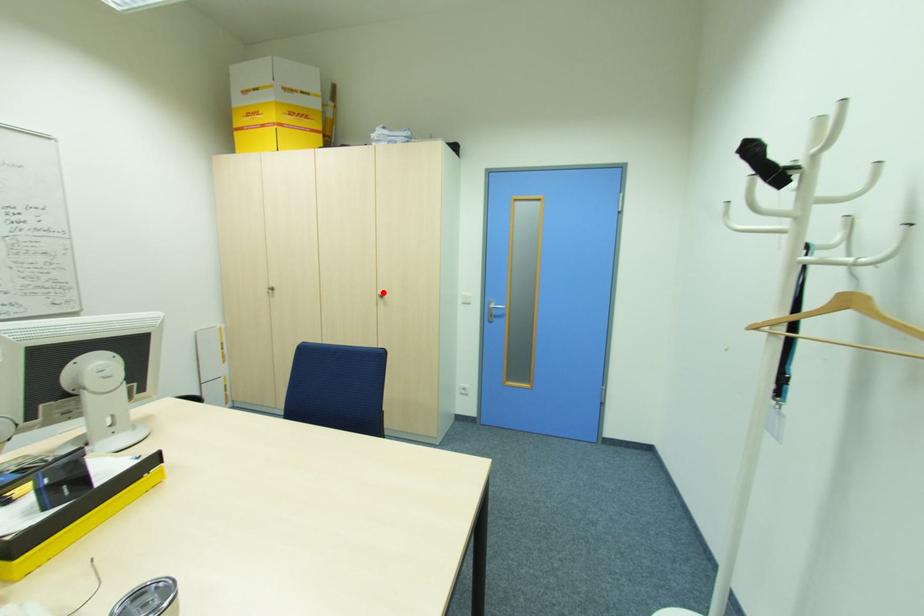
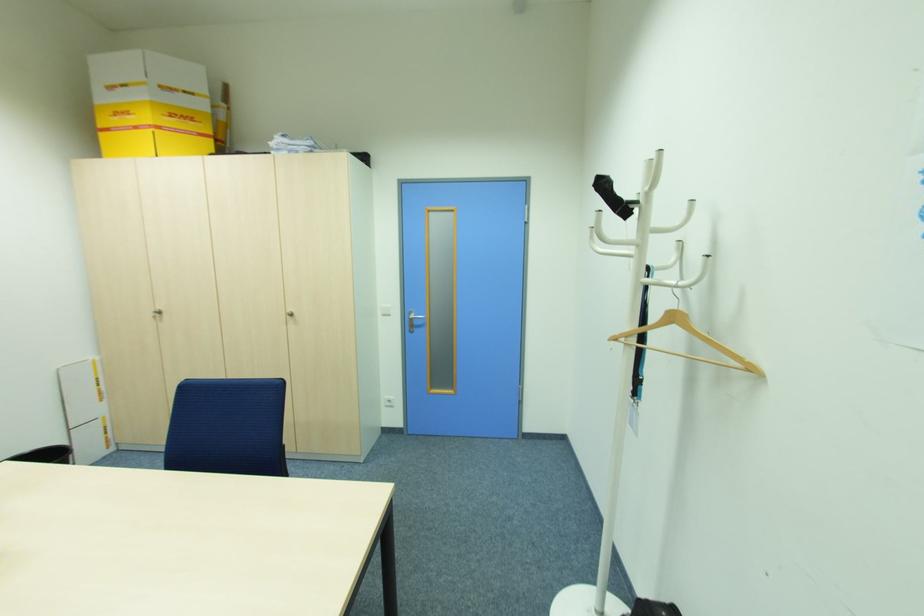
Locate, in the second image, the point that corresponds to the highlighted location in the first image.

(292, 310)